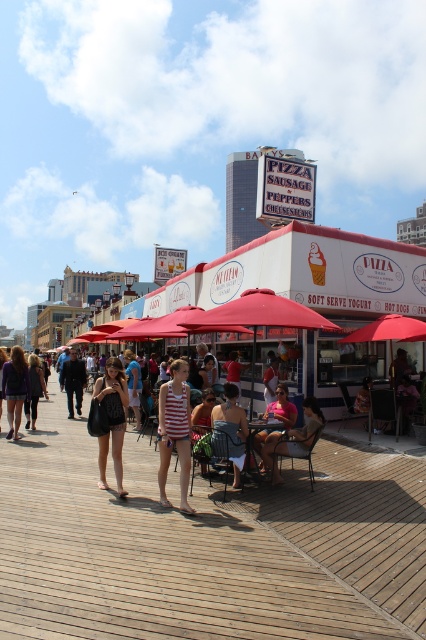
Is matte black shorts at left taller than striped tank top at center?

Yes.

Does matte black shorts at left have a greater width compared to striped tank top at center?

In fact, matte black shorts at left might be narrower than striped tank top at center.

The image size is (426, 640). Find the location of `matte black shorts at left`. matte black shorts at left is located at coordinates (14, 388).

Who is more distant from viewer, [115,472] or [34,392]?

The point [34,392] is behind.

Is point (95, 432) farther from camera compared to point (32, 365)?

No.

What do you see at coordinates (109, 419) in the screenshot? The height and width of the screenshot is (640, 426). I see `matte black bag at center` at bounding box center [109, 419].

You are a GUI agent. You are given a task and a screenshot of the screen. Output one action in this format:
    pyautogui.click(x=<x>, y=<y>)
    Task: Click on the matte black bag at center
    The width and height of the screenshot is (426, 640).
    Given the screenshot: What is the action you would take?
    pyautogui.click(x=109, y=419)

Between matte black bag at center and matte black shorts at left, which one has more height?

matte black shorts at left is taller.

You are a GUI agent. You are given a task and a screenshot of the screen. Output one action in this format:
    pyautogui.click(x=<x>, y=<y>)
    Task: Click on the matte black bag at center
    This screenshot has height=640, width=426.
    Given the screenshot: What is the action you would take?
    pyautogui.click(x=109, y=419)